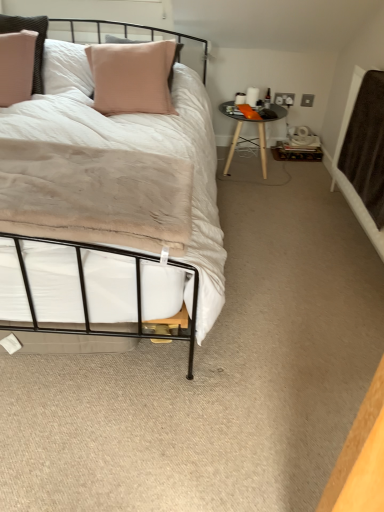
Question: Is brown textured blanket at right smaller than black glossy table at center right?

Choices:
 (A) yes
 (B) no

Answer: (A)

Question: Considering the relative sizes of brown textured blanket at right and black glossy table at center right in the image provided, is brown textured blanket at right shorter than black glossy table at center right?

Choices:
 (A) no
 (B) yes

Answer: (A)

Question: Is brown textured blanket at right next to black glossy table at center right?

Choices:
 (A) yes
 (B) no

Answer: (B)

Question: From a real-world perspective, is brown textured blanket at right over black glossy table at center right?

Choices:
 (A) yes
 (B) no

Answer: (A)

Question: Can you confirm if brown textured blanket at right is positioned to the right of black glossy table at center right?

Choices:
 (A) no
 (B) yes

Answer: (B)

Question: Are brown textured blanket at right and black glossy table at center right located far from each other?

Choices:
 (A) no
 (B) yes

Answer: (A)

Question: Is black glossy table at center right turned away from brown textured blanket at right?

Choices:
 (A) no
 (B) yes

Answer: (A)

Question: Considering the relative sizes of black glossy table at center right and brown textured blanket at right in the image provided, is black glossy table at center right taller than brown textured blanket at right?

Choices:
 (A) yes
 (B) no

Answer: (B)

Question: Considering the relative positions of black glossy table at center right and brown textured blanket at right in the image provided, is black glossy table at center right to the right of brown textured blanket at right from the viewer's perspective?

Choices:
 (A) yes
 (B) no

Answer: (B)

Question: Considering the relative sizes of black glossy table at center right and brown textured blanket at right in the image provided, is black glossy table at center right thinner than brown textured blanket at right?

Choices:
 (A) no
 (B) yes

Answer: (A)

Question: Does black glossy table at center right have a lesser height compared to brown textured blanket at right?

Choices:
 (A) yes
 (B) no

Answer: (A)

Question: Is there a large distance between black glossy table at center right and brown textured blanket at right?

Choices:
 (A) no
 (B) yes

Answer: (A)

Question: In terms of height, does brown textured blanket at right look taller or shorter compared to black glossy table at center right?

Choices:
 (A) short
 (B) tall

Answer: (B)